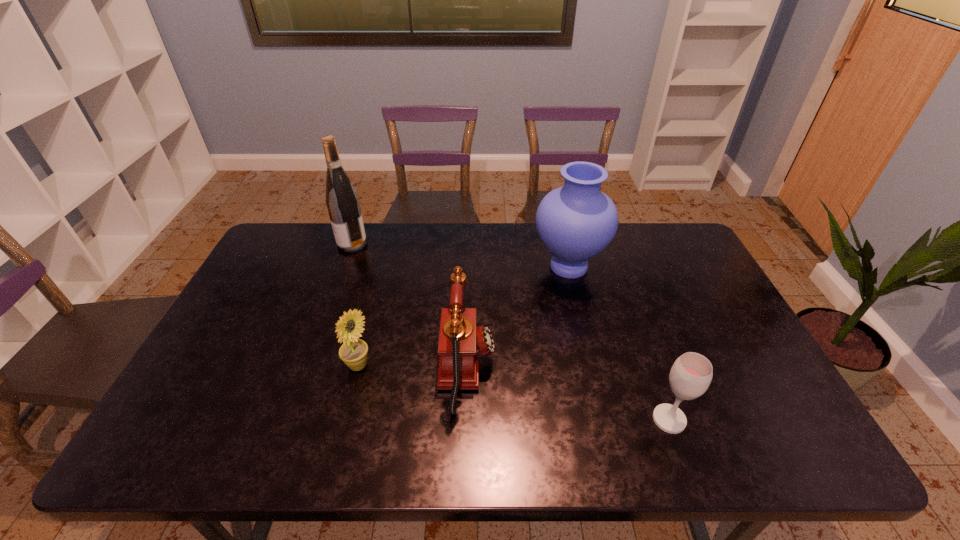
Locate an element on the screen. blank space located on the face of the fourth object from right to left is located at coordinates (489, 366).

Find the location of a particular element. wine bottle at the far edge is located at coordinates (342, 201).

Find the location of a particular element. Image resolution: width=960 pixels, height=540 pixels. vase that is positioned at the far edge is located at coordinates (576, 222).

This screenshot has width=960, height=540. Identify the location of object at the near edge. (690, 376).

Locate an element on the screen. vacant area at the far edge is located at coordinates (590, 261).

The width and height of the screenshot is (960, 540). I want to click on vacant space at the near edge of the desktop, so click(x=465, y=440).

Locate an element on the screen. The width and height of the screenshot is (960, 540). vacant space at the left edge of the desktop is located at coordinates (272, 266).

Image resolution: width=960 pixels, height=540 pixels. Identify the location of vacant position at the right edge of the desktop. (669, 287).

Find the location of a particular element. The image size is (960, 540). vacant point at the far left corner is located at coordinates (313, 244).

The width and height of the screenshot is (960, 540). In the image, there is a desktop. In order to click on free space at the far right corner in this screenshot , I will do `click(676, 227)`.